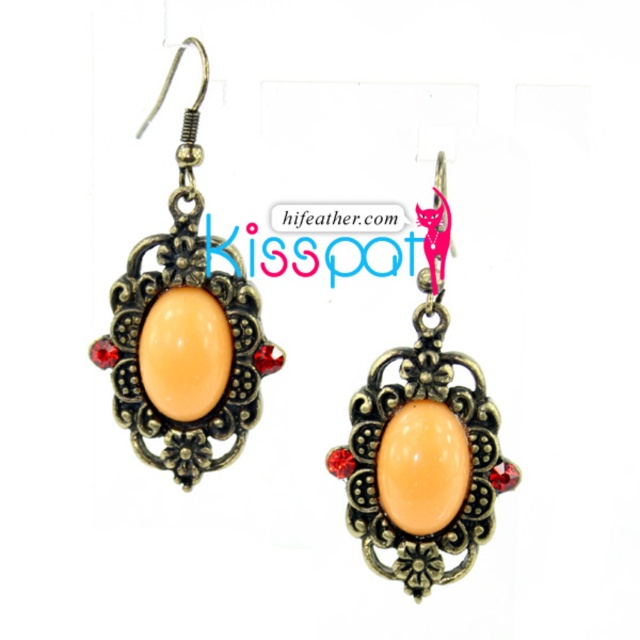
Is point (189, 337) positioned in front of point (416, 317)?

No, it is behind (416, 317).

Is matte orange stone at center further to the viewer compared to matte gold earring at center?

Yes.

I want to click on matte orange stone at center, so click(x=186, y=330).